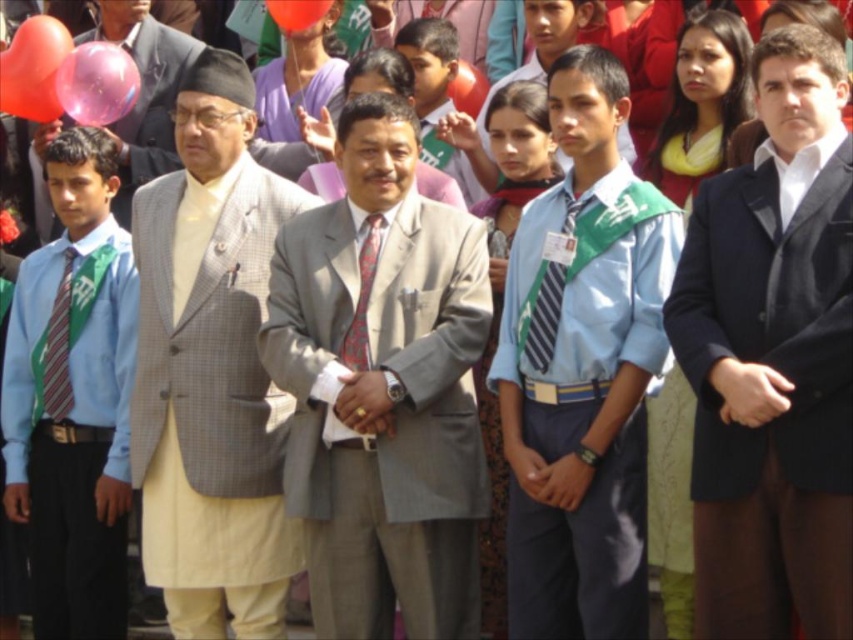
Is smooth brown leather hand at center to the right of rubber balloon at upper center from the viewer's perspective?

In fact, smooth brown leather hand at center is to the left of rubber balloon at upper center.

Which is in front, point (332, 406) or point (483, 83)?

Point (332, 406) is more forward.

Between point (337, 400) and point (474, 104), which one is positioned in front?

Point (337, 400)

Locate an element on the screen. The height and width of the screenshot is (640, 853). smooth brown leather hand at center is located at coordinates 364,403.

I want to click on blue fabric shirt at center, so click(x=582, y=369).

At what (x,y) coordinates should I click in order to perform the action: click on blue fabric shirt at center. Please return your answer as a coordinate pair (x, y). Looking at the image, I should click on (582, 369).

Does point (451, 170) come behind point (392, 410)?

Yes.

Can you confirm if matte gray suit at center is bigger than smooth brown leather hand at center?

Yes.

Is point (463, 172) closer to camera compared to point (373, 392)?

No, it is not.

You are a GUI agent. You are given a task and a screenshot of the screen. Output one action in this format:
    pyautogui.click(x=<x>, y=<y>)
    Task: Click on the matte gray suit at center
    
    Given the screenshot: What is the action you would take?
    pyautogui.click(x=436, y=96)